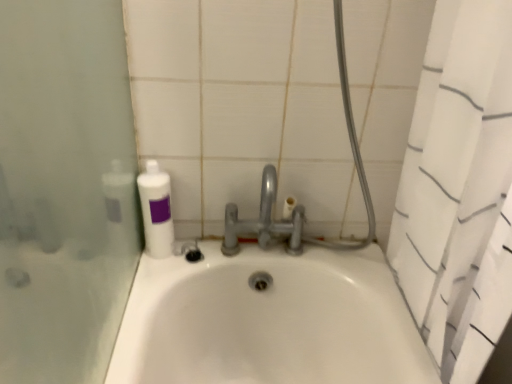
Question: From a real-world perspective, relative to white textured shower curtain at right, is white matte bottle at upper left vertically above or below?

Choices:
 (A) above
 (B) below

Answer: (A)

Question: Is white matte bottle at upper left bigger or smaller than white textured shower curtain at right?

Choices:
 (A) big
 (B) small

Answer: (B)

Question: Which object is positioned closest to the white matte bottle at upper left?

Choices:
 (A) white textured shower curtain at right
 (B) satin nickel faucet at center

Answer: (B)

Question: Which is nearer to the white textured shower curtain at right?

Choices:
 (A) white matte bottle at upper left
 (B) satin nickel faucet at center

Answer: (B)